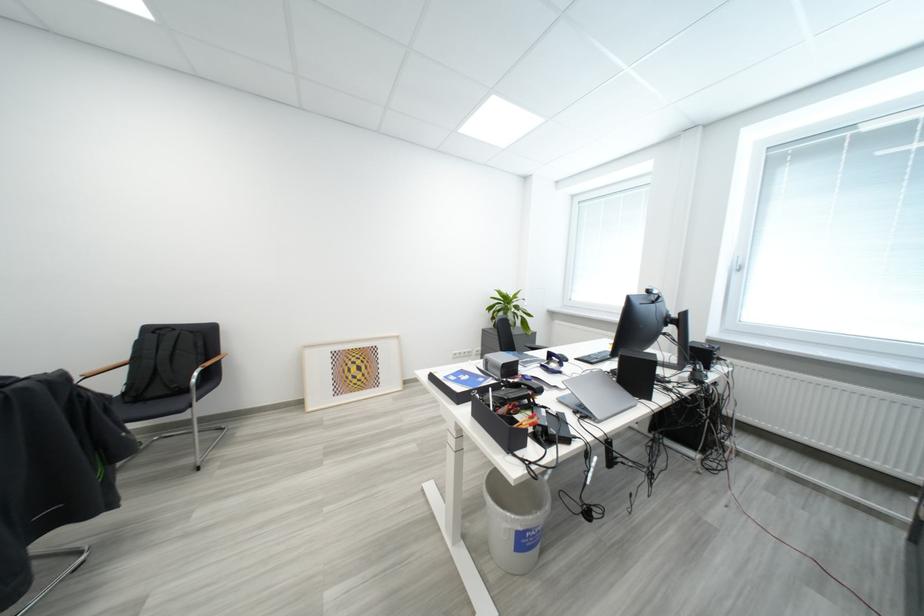
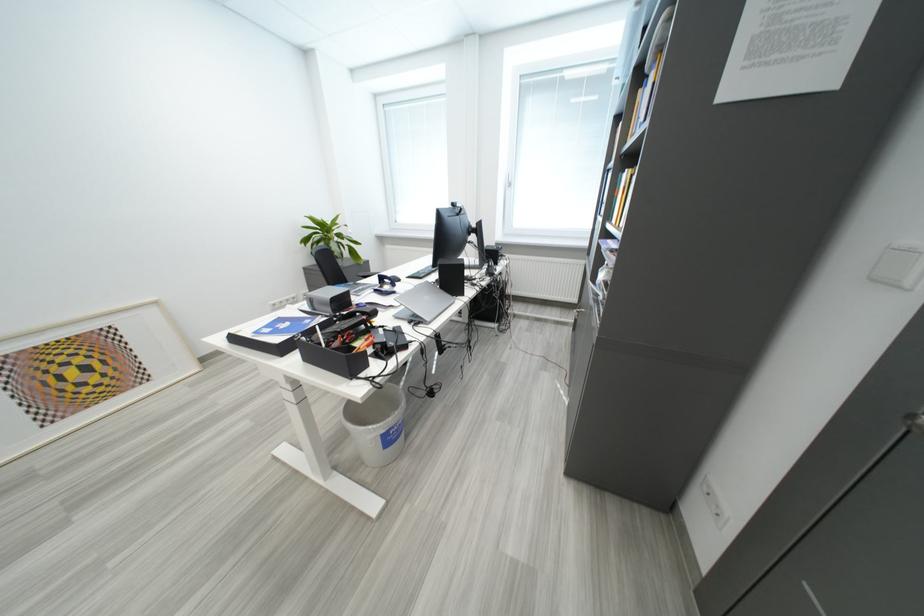
The point at (368, 365) is marked in the first image. Where is the corresponding point in the second image?

(88, 363)